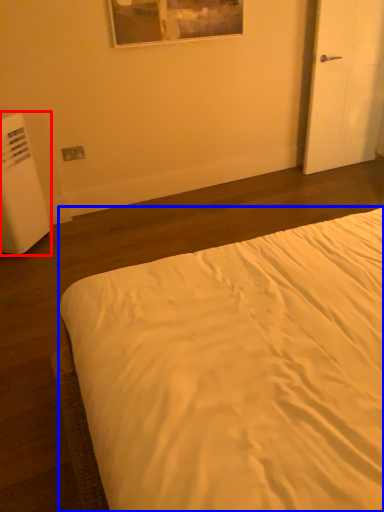
Question: Which object appears closest to the camera in this image, water heater (highlighted by a red box) or bed (highlighted by a blue box)?

Choices:
 (A) water heater
 (B) bed

Answer: (B)